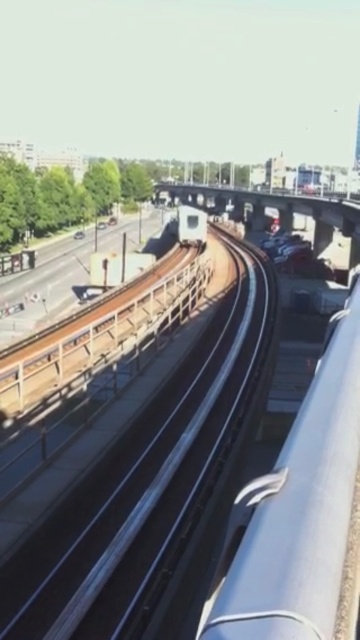
You are a pedestrian standing on the platform and want to cross the tracks to reach the white glossy train at center. The smooth steel train track at center is in your way. Which direction should you move to get around the track and reach the train?

The smooth steel train track at center is positioned on the left side of white glossy train at center. Therefore, to reach the train, you should move to the right side of the track.

From the picture: You are a city planner analyzing the train route. Based on the image, which object is positioned lower in the scene between the smooth steel train track at center and the white glossy train at center?

The smooth steel train track at center is located below the white glossy train at center, so it is positioned lower in the scene.

You are a city planner analyzing the urban layout. You observe the smooth steel train track at center and the white glossy train at center in the scene. Which object occupies more visual space in the image?

The white glossy train at center occupies more visual space than the smooth steel train track at center because the train is described as larger in the scene.